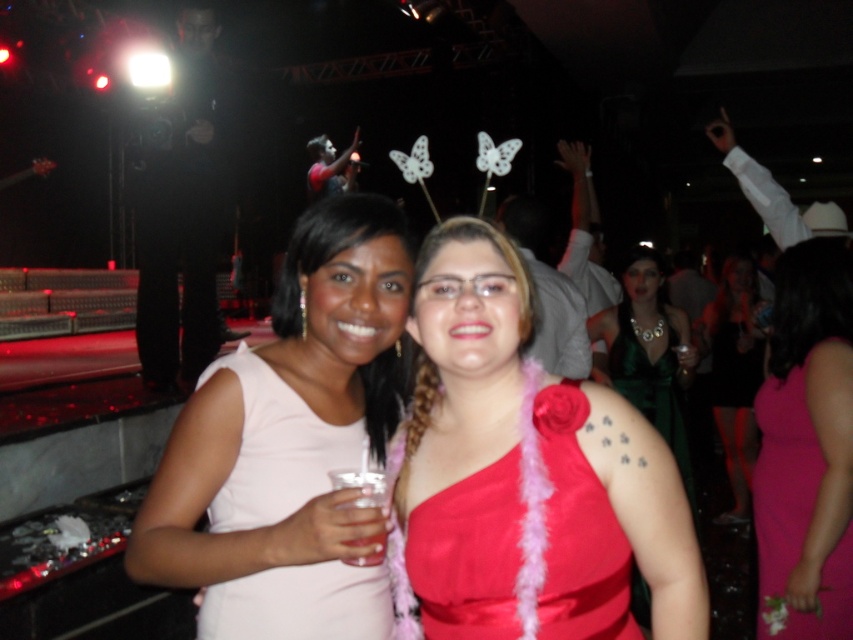
Question: Which of the following is the closest to the observer?

Choices:
 (A) matte white dress at center
 (B) matte green dress at center
 (C) satin dress at center
 (D) white matte dress at center

Answer: (A)

Question: From the image, what is the correct spatial relationship of satin red dress at center in relation to clear plastic cup at center?

Choices:
 (A) right
 (B) left

Answer: (A)

Question: Can you confirm if matte white dress at center is wider than green satin dress at center?

Choices:
 (A) no
 (B) yes

Answer: (A)

Question: Is pink satin dress at lower right closer to camera compared to clear plastic cup at center?

Choices:
 (A) yes
 (B) no

Answer: (B)

Question: Which object is the farthest from the pink satin dress at lower right?

Choices:
 (A) satin red dress at center
 (B) green satin dress at center
 (C) clear plastic cup at center
 (D) matte green dress at center

Answer: (D)

Question: Estimate the real-world distances between objects in this image. Which object is farther from the green satin dress at center?

Choices:
 (A) matte green dress at center
 (B) white matte dress at center
 (C) clear plastic cup at center

Answer: (C)